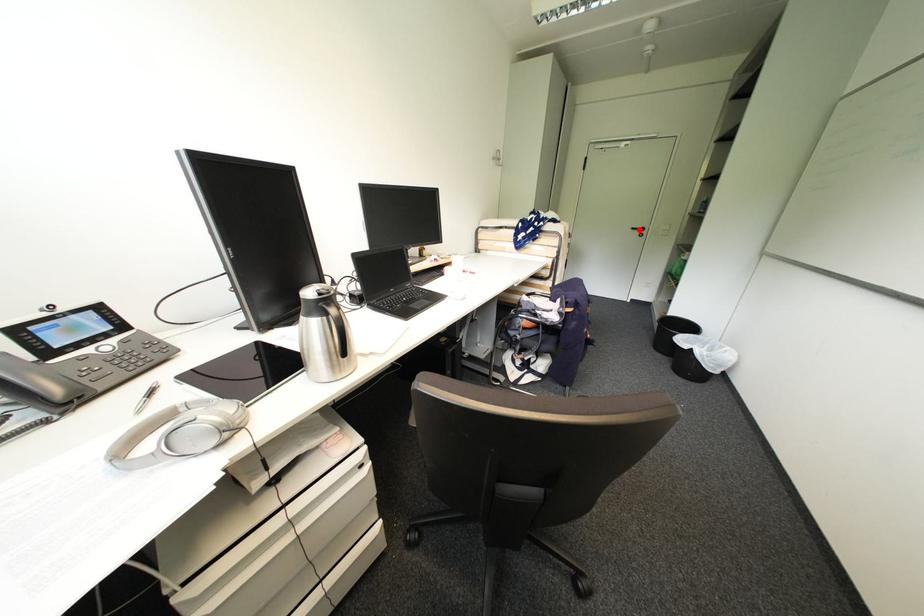
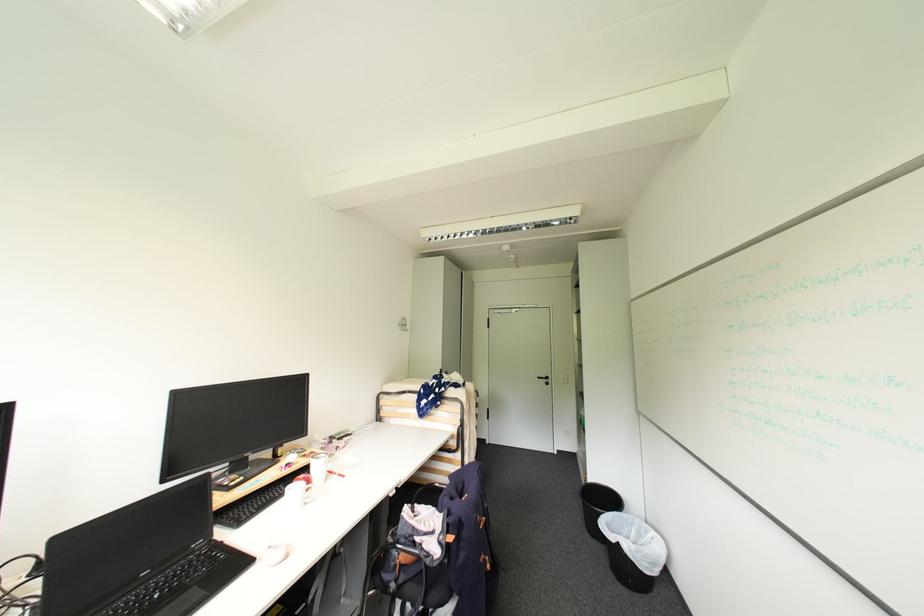
Find the pixel in the second image that matches the highlighted location in the first image.

(544, 379)